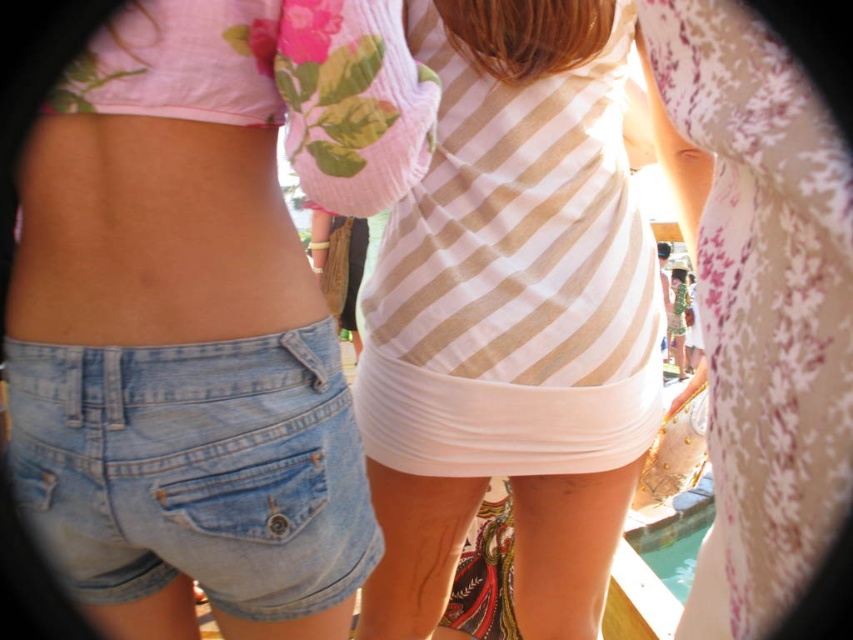
The width and height of the screenshot is (853, 640). What do you see at coordinates (511, 317) in the screenshot?
I see `white striped tank top at center` at bounding box center [511, 317].

Is point (531, 33) farther from camera compared to point (421, 445)?

No, (531, 33) is closer to viewer.

Where is `white striped tank top at center`? Image resolution: width=853 pixels, height=640 pixels. white striped tank top at center is located at coordinates (511, 317).

Which is more to the left, denim shorts at left or light blue denim shorts at lower left?

Positioned to the left is light blue denim shorts at lower left.

Between point (241, 225) and point (59, 417), which one is positioned behind?

Point (241, 225)

Where is `denim shorts at left`? This screenshot has height=640, width=853. denim shorts at left is located at coordinates (213, 268).

Is white striped tank top at center further to camera compared to light blue denim shorts at lower left?

Yes, it is.

Can you confirm if white striped tank top at center is positioned to the left of light blue denim shorts at lower left?

No, white striped tank top at center is not to the left of light blue denim shorts at lower left.

Is point (624, 401) positioned before point (292, 461)?

No, it is not.

You are a GUI agent. You are given a task and a screenshot of the screen. Output one action in this format:
    pyautogui.click(x=<x>, y=<y>)
    Task: Click on the white striped tank top at center
    The image size is (853, 640).
    Given the screenshot: What is the action you would take?
    pyautogui.click(x=511, y=317)